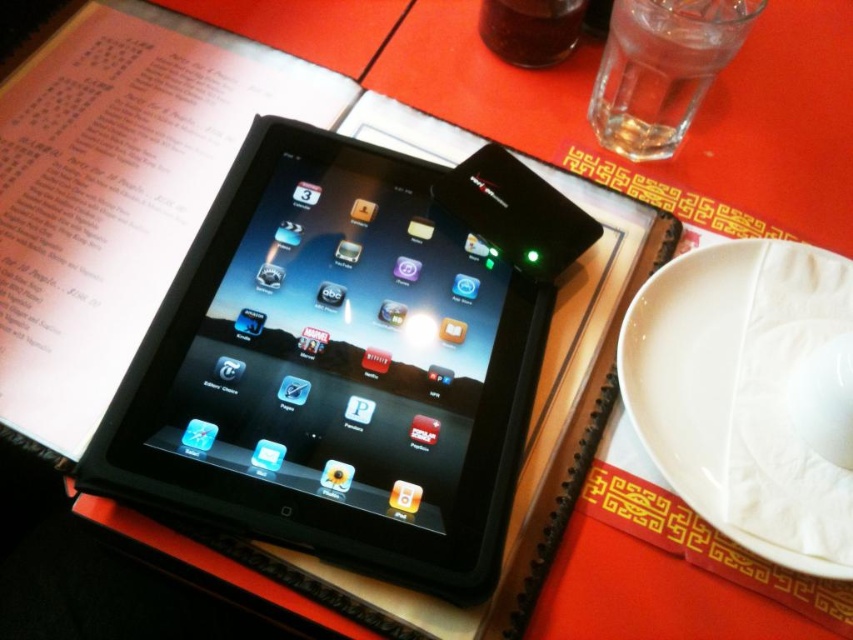
Question: Does black matte tablet computer at center have a lesser width compared to transparent glass at upper center?

Choices:
 (A) no
 (B) yes

Answer: (A)

Question: Which point is farther from the camera taking this photo?

Choices:
 (A) (614, 10)
 (B) (776, 520)
 (C) (370, 160)

Answer: (A)

Question: Can you confirm if black matte tablet computer at center is positioned to the right of white matte plate at lower right?

Choices:
 (A) no
 (B) yes

Answer: (A)

Question: Among these objects, which one is nearest to the camera?

Choices:
 (A) clear glass water at upper right
 (B) white matte plate at lower right

Answer: (B)

Question: Among these objects, which one is farthest from the camera?

Choices:
 (A) clear glass water at upper right
 (B) transparent glass at upper center
 (C) white matte plate at lower right
 (D) black matte tablet computer at center

Answer: (B)

Question: Is white matte plate at lower right thinner than clear glass water at upper right?

Choices:
 (A) no
 (B) yes

Answer: (A)